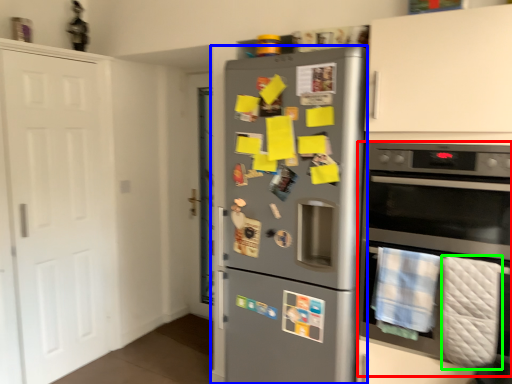
Question: Which object is the farthest from oven (highlighted by a red box)? Choose among these: refrigerator (highlighted by a blue box) or blanket (highlighted by a green box).

Choices:
 (A) refrigerator
 (B) blanket

Answer: (A)